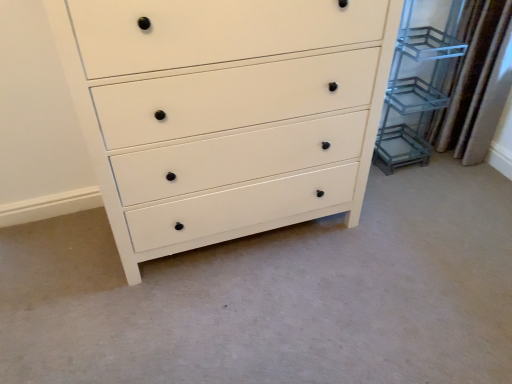
What do you see at coordinates (225, 112) in the screenshot? The height and width of the screenshot is (384, 512). I see `white matte chest of drawers at center` at bounding box center [225, 112].

At what (x,y) coordinates should I click in order to perform the action: click on clear glass shelving unit at right. Please return your answer as a coordinate pair (x, y). Looking at the image, I should click on (414, 97).

This screenshot has width=512, height=384. What do you see at coordinates (414, 97) in the screenshot?
I see `clear glass shelving unit at right` at bounding box center [414, 97].

This screenshot has height=384, width=512. What do you see at coordinates (474, 77) in the screenshot? I see `brown textured curtain at right` at bounding box center [474, 77].

Find the location of `white matte chest of drawers at center`. white matte chest of drawers at center is located at coordinates (225, 112).

Consider the image. Is clear glass shelving unit at right further to camera compared to white matte chest of drawers at center?

Yes, clear glass shelving unit at right is further from the viewer.

Is clear glass shelving unit at right located outside white matte chest of drawers at center?

Yes, clear glass shelving unit at right is not within white matte chest of drawers at center.

Consider the image. Is clear glass shelving unit at right taller or shorter than white matte chest of drawers at center?

Considering their sizes, clear glass shelving unit at right has less height than white matte chest of drawers at center.

Is clear glass shelving unit at right oriented towards white matte chest of drawers at center?

No, clear glass shelving unit at right does not turn towards white matte chest of drawers at center.

Could you tell me if white matte chest of drawers at center is turned towards brown textured curtain at right?

No, white matte chest of drawers at center does not turn towards brown textured curtain at right.

Which object is thinner, white matte chest of drawers at center or brown textured curtain at right?

brown textured curtain at right is thinner.

The height and width of the screenshot is (384, 512). There is a brown textured curtain at right. Identify the location of the chest of drawers above it (from a real-world perspective). (225, 112).

Is brown textured curtain at right turned away from white matte chest of drawers at center?

Result: No, white matte chest of drawers at center is not at the back of brown textured curtain at right.

Is brown textured curtain at right completely or partially outside of white matte chest of drawers at center?

Indeed, brown textured curtain at right is completely outside white matte chest of drawers at center.

From the image's perspective, is brown textured curtain at right positioned above or below white matte chest of drawers at center?

Clearly, from the image's perspective, brown textured curtain at right is above white matte chest of drawers at center.

In the scene shown: Relative to white matte chest of drawers at center, is brown textured curtain at right in front or behind?

Clearly, brown textured curtain at right is behind white matte chest of drawers at center.

Is white matte chest of drawers at center completely or partially outside of clear glass shelving unit at right?

white matte chest of drawers at center lies outside clear glass shelving unit at right's area.

Can you confirm if white matte chest of drawers at center is positioned to the left of clear glass shelving unit at right?

Indeed, white matte chest of drawers at center is positioned on the left side of clear glass shelving unit at right.

Would you say white matte chest of drawers at center is a long distance from clear glass shelving unit at right?

No, white matte chest of drawers at center is not far from clear glass shelving unit at right.

Between white matte chest of drawers at center and clear glass shelving unit at right, which one has smaller width?

With smaller width is clear glass shelving unit at right.

Is clear glass shelving unit at right located within brown textured curtain at right?

Definitely not — clear glass shelving unit at right is not inside brown textured curtain at right.

Is brown textured curtain at right closer to camera compared to clear glass shelving unit at right?

No, brown textured curtain at right is further to the viewer.

Considering the relative sizes of brown textured curtain at right and clear glass shelving unit at right in the image provided, is brown textured curtain at right shorter than clear glass shelving unit at right?

Indeed, brown textured curtain at right has a lesser height compared to clear glass shelving unit at right.

Who is taller, clear glass shelving unit at right or brown textured curtain at right?

clear glass shelving unit at right.

Does point (456, 48) appear closer or farther from the camera than point (510, 12)?

Point (456, 48) appears to be farther away from the viewer than point (510, 12).

Considering the sizes of objects clear glass shelving unit at right and brown textured curtain at right in the image provided, who is smaller, clear glass shelving unit at right or brown textured curtain at right?

brown textured curtain at right is smaller.

From a real-world perspective, relative to brown textured curtain at right, is clear glass shelving unit at right vertically above or below?

clear glass shelving unit at right is situated higher than brown textured curtain at right in the real world.

Locate an element on the screen. The height and width of the screenshot is (384, 512). cabinet that is under the white matte chest of drawers at center (from a real-world perspective) is located at coordinates click(414, 97).

Locate an element on the screen. the chest of drawers in front of the brown textured curtain at right is located at coordinates (225, 112).

When comparing their distances from brown textured curtain at right, does clear glass shelving unit at right or white matte chest of drawers at center seem closer?

clear glass shelving unit at right lies closer to brown textured curtain at right than the other object.

Which object lies further to the anchor point white matte chest of drawers at center, clear glass shelving unit at right or brown textured curtain at right?

brown textured curtain at right is further to white matte chest of drawers at center.

Looking at the image, which one is located closer to white matte chest of drawers at center, brown textured curtain at right or clear glass shelving unit at right?

The object closer to white matte chest of drawers at center is clear glass shelving unit at right.

Which object lies nearer to the anchor point clear glass shelving unit at right, white matte chest of drawers at center or brown textured curtain at right?

brown textured curtain at right is positioned closer to the anchor clear glass shelving unit at right.

Based on the photo, which object lies nearer to the anchor point brown textured curtain at right, white matte chest of drawers at center or clear glass shelving unit at right?

clear glass shelving unit at right lies closer to brown textured curtain at right than the other object.

Based on their spatial positions, is brown textured curtain at right or white matte chest of drawers at center further from clear glass shelving unit at right?

Based on the image, white matte chest of drawers at center appears to be further to clear glass shelving unit at right.

Locate an element on the screen. cabinet between white matte chest of drawers at center and brown textured curtain at right from left to right is located at coordinates (414, 97).